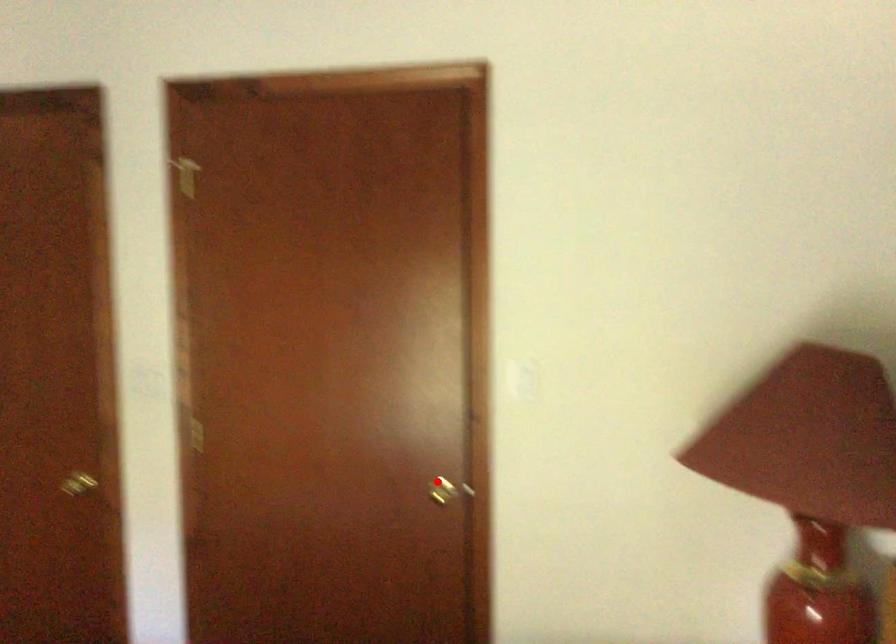
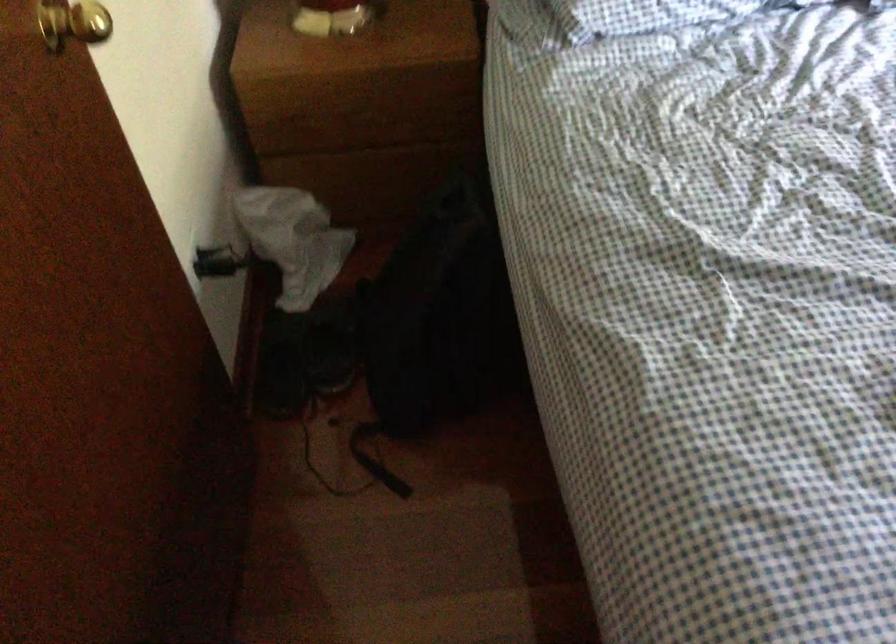
Question: I am providing you with two images of the same scene from different viewpoints. In image1, a red point is highlighted. Considering the same 3D point in image2, which of the following is correct?

Choices:
 (A) It is closer
 (B) It is farther

Answer: (A)